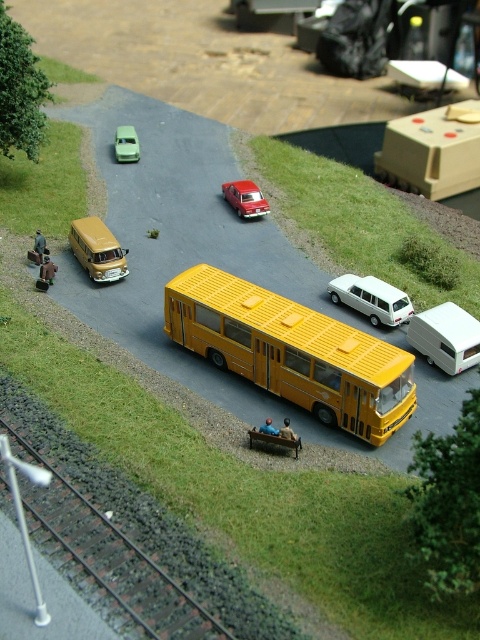
Can you confirm if white matte station wagon at center is smaller than shiny red car at center?

Incorrect, white matte station wagon at center is not smaller in size than shiny red car at center.

The image size is (480, 640). I want to click on white matte station wagon at center, so click(x=371, y=298).

Where is `white matte station wagon at center`? This screenshot has height=640, width=480. white matte station wagon at center is located at coordinates (371, 298).

Between point (199, 305) and point (132, 157), which one is positioned behind?

Point (132, 157)

Identify the location of yellow matte bus at center. (292, 352).

Does point (10, 433) lie behind point (241, 200)?

No, it is not.

Which is behind, point (167, 632) or point (265, 204)?

Positioned behind is point (265, 204).

Who is more distant from viewer, (64, 522) or (253, 195)?

Positioned behind is point (253, 195).

Locate an element on the screen. This screenshot has width=480, height=640. black gravel train track at lower left is located at coordinates (116, 560).